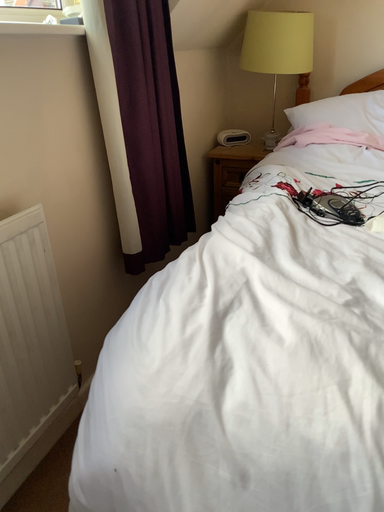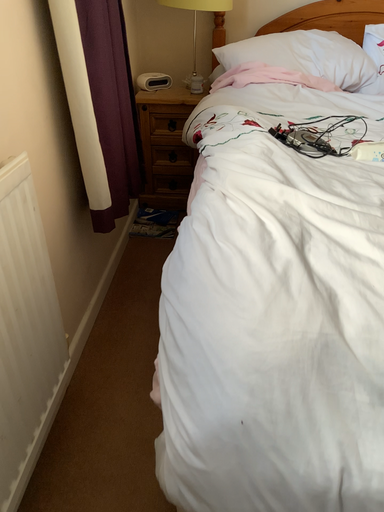
Question: How did the camera likely rotate when shooting the video?

Choices:
 (A) rotated right
 (B) rotated left

Answer: (A)